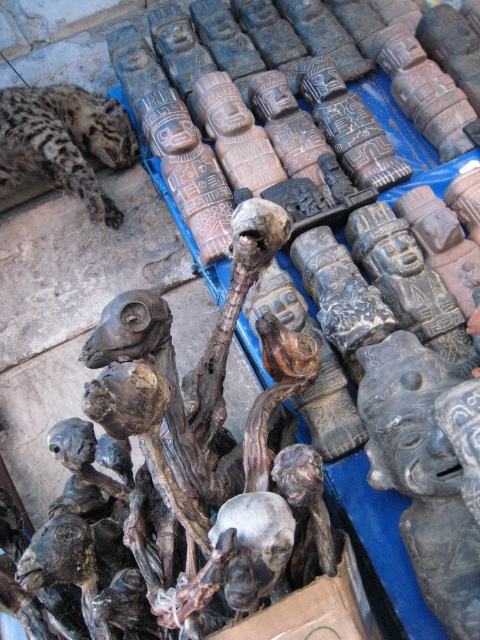
You are setting up a display for an art exhibition and need to arrange the brown wood skull at center and the spotted fur cheetah at upper left on a shelf. The shelf has a width of 1 meter. If you place them side by side, will they fit without overlapping?

The brown wood skull at center might be wider than the spotted fur cheetah at upper left, but since the total width of both items combined is not specified, it is uncertain whether they will fit on the 1 meter shelf without overlapping. Additional measurements are needed to determine this.

You are a customer at the market and want to examine the brown wood skull at center. If you are standing 30 inches away from the display, can you reach it without moving closer?

The brown wood skull at center is 36.63 inches from the viewer. Since you are standing 30 inches away, you are still 6.63 inches too far to reach it without moving closer.

Based on the photo, you are at a craft stall and want to find the brown wood skull at center. If you are standing directly in front of the stall, which direction should you look to find it?

The brown wood skull at center is located at the coordinates 0.741 on the x axis and 0.367 on the y axis. Since you are standing directly in front of the stall, you should look towards the right side and slightly downward to find the brown wood skull at center.